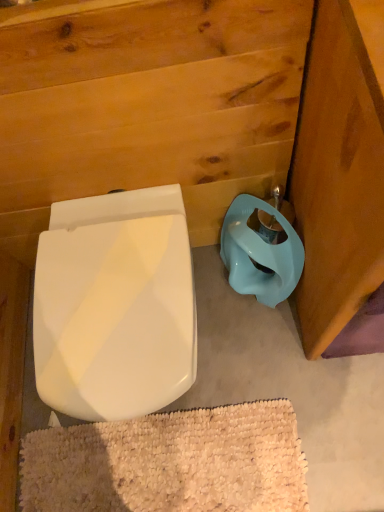
Image resolution: width=384 pixels, height=512 pixels. I want to click on matte blue plastic toilet bowl at lower right, so click(260, 253).

You are a GUI agent. You are given a task and a screenshot of the screen. Output one action in this format:
    pyautogui.click(x=<x>, y=<y>)
    Task: Click on the white glossy toilet seat at lower left
    
    Given the screenshot: What is the action you would take?
    pyautogui.click(x=115, y=305)

From the image's perspective, which one is positioned higher, matte blue plastic toilet bowl at lower right or white textured bath mat at lower center?

matte blue plastic toilet bowl at lower right, from the image's perspective.

How many degrees apart are the facing directions of matte blue plastic toilet bowl at lower right and white textured bath mat at lower center?

1.29 degrees.

Is the position of matte blue plastic toilet bowl at lower right less distant than that of white textured bath mat at lower center?

Yes, the depth of matte blue plastic toilet bowl at lower right is less than that of white textured bath mat at lower center.

Is white glossy toilet seat at lower left inside or outside of white textured bath mat at lower center?

white glossy toilet seat at lower left cannot be found inside white textured bath mat at lower center.

Would you say white glossy toilet seat at lower left is a long distance from white textured bath mat at lower center?

No.

Between white glossy toilet seat at lower left and white textured bath mat at lower center, which one is positioned in front?

Positioned in front is white glossy toilet seat at lower left.

Is white glossy toilet seat at lower left smaller than white textured bath mat at lower center?

Incorrect, white glossy toilet seat at lower left is not smaller in size than white textured bath mat at lower center.

Considering the relative sizes of matte blue plastic toilet bowl at lower right and white glossy toilet seat at lower left in the image provided, is matte blue plastic toilet bowl at lower right shorter than white glossy toilet seat at lower left?

Indeed, matte blue plastic toilet bowl at lower right has a lesser height compared to white glossy toilet seat at lower left.

From the image's perspective, between matte blue plastic toilet bowl at lower right and white glossy toilet seat at lower left, who is located below?

white glossy toilet seat at lower left, from the image's perspective.

Locate an element on the screen. toilet bowl above the white glossy toilet seat at lower left (from the image's perspective) is located at coordinates (260, 253).

Between matte blue plastic toilet bowl at lower right and white glossy toilet seat at lower left, which one appears on the left side from the viewer's perspective?

white glossy toilet seat at lower left is more to the left.

This screenshot has height=512, width=384. Identify the location of toilet bowl above the white textured bath mat at lower center (from a real-world perspective). (260, 253).

Is white textured bath mat at lower center further to camera compared to matte blue plastic toilet bowl at lower right?

That is True.

Based on their sizes in the image, would you say white textured bath mat at lower center is bigger or smaller than matte blue plastic toilet bowl at lower right?

white textured bath mat at lower center is smaller than matte blue plastic toilet bowl at lower right.

Would you say white textured bath mat at lower center contains matte blue plastic toilet bowl at lower right?

No, matte blue plastic toilet bowl at lower right is not inside white textured bath mat at lower center.

Looking at this image, which is in front, white textured bath mat at lower center or white glossy toilet seat at lower left?

white glossy toilet seat at lower left is closer to the camera.

From the image's perspective, which is above, white textured bath mat at lower center or white glossy toilet seat at lower left?

white glossy toilet seat at lower left appears higher in the image.

Is white textured bath mat at lower center not inside white glossy toilet seat at lower left?

Yes, white textured bath mat at lower center is outside of white glossy toilet seat at lower left.

Which object is positioned more to the right, white textured bath mat at lower center or white glossy toilet seat at lower left?

white textured bath mat at lower center is more to the right.

Would you say white glossy toilet seat at lower left is inside or outside matte blue plastic toilet bowl at lower right?

white glossy toilet seat at lower left is outside matte blue plastic toilet bowl at lower right.

Between white glossy toilet seat at lower left and matte blue plastic toilet bowl at lower right, which one appears on the right side from the viewer's perspective?

From the viewer's perspective, matte blue plastic toilet bowl at lower right appears more on the right side.

How much distance is there between white glossy toilet seat at lower left and matte blue plastic toilet bowl at lower right?

A distance of 13.72 inches exists between white glossy toilet seat at lower left and matte blue plastic toilet bowl at lower right.

You are a GUI agent. You are given a task and a screenshot of the screen. Output one action in this format:
    pyautogui.click(x=<x>, y=<y>)
    Task: Click on the bath mat on the left of matte blue plastic toilet bowl at lower right
    The image size is (384, 512).
    Given the screenshot: What is the action you would take?
    pyautogui.click(x=170, y=463)

In the image, there is a white glossy toilet seat at lower left. What are the coordinates of `bath mat below it (from a real-world perspective)` in the screenshot? It's located at (170, 463).

In the scene shown: Which object lies further to the anchor point white textured bath mat at lower center, matte blue plastic toilet bowl at lower right or white glossy toilet seat at lower left?

Among the two, matte blue plastic toilet bowl at lower right is located further to white textured bath mat at lower center.

From the image, which object appears to be farther from white glossy toilet seat at lower left, matte blue plastic toilet bowl at lower right or white textured bath mat at lower center?

The object further to white glossy toilet seat at lower left is white textured bath mat at lower center.

From the image, which object appears to be farther from white textured bath mat at lower center, white glossy toilet seat at lower left or matte blue plastic toilet bowl at lower right?

Based on the image, matte blue plastic toilet bowl at lower right appears to be further to white textured bath mat at lower center.

From the image, which object appears to be farther from matte blue plastic toilet bowl at lower right, white textured bath mat at lower center or white glossy toilet seat at lower left?

white textured bath mat at lower center is further to matte blue plastic toilet bowl at lower right.

When comparing their distances from white glossy toilet seat at lower left, does white textured bath mat at lower center or matte blue plastic toilet bowl at lower right seem further?

white textured bath mat at lower center.

Looking at the image, which one is located further to matte blue plastic toilet bowl at lower right, white glossy toilet seat at lower left or white textured bath mat at lower center?

white textured bath mat at lower center lies further to matte blue plastic toilet bowl at lower right than the other object.

You are a GUI agent. You are given a task and a screenshot of the screen. Output one action in this format:
    pyautogui.click(x=<x>, y=<y>)
    Task: Click on the toilet that lies between matte blue plastic toilet bowl at lower right and white textured bath mat at lower center from top to bottom
    
    Given the screenshot: What is the action you would take?
    pyautogui.click(x=115, y=305)